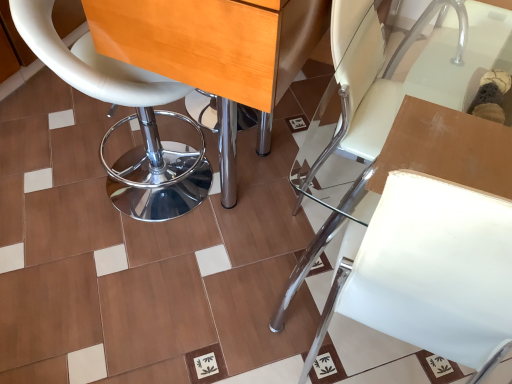
What do you see at coordinates (398, 99) in the screenshot? I see `white leather chair at center, placed as the 2th chair when sorted from left to right` at bounding box center [398, 99].

Where is `white leather chair at center, the first chair in the right-to-left sequence`? white leather chair at center, the first chair in the right-to-left sequence is located at coordinates (398, 99).

Between white leather stool at left, which is the 2th chair from right to left, and wooden table at center, which one has less height?

white leather stool at left, which is the 2th chair from right to left.

Considering the sizes of objects white leather stool at left, which is the 2th chair from right to left, and wooden table at center in the image provided, who is thinner, white leather stool at left, which is the 2th chair from right to left, or wooden table at center?

Thinner between the two is white leather stool at left, which is the 2th chair from right to left.

Can you tell me how much white leather stool at left, placed as the first chair when sorted from left to right, and wooden table at center differ in facing direction?

The facing directions of white leather stool at left, placed as the first chair when sorted from left to right, and wooden table at center are 0.353 degrees apart.

From the image's perspective, which is below, white leather stool at left, which is the 2th chair from right to left, or white leather chair at center, placed as the 2th chair when sorted from left to right?

From the image's view, white leather chair at center, placed as the 2th chair when sorted from left to right, is below.

Which object is thinner, white leather stool at left, placed as the first chair when sorted from left to right, or white leather chair at center, the first chair in the right-to-left sequence?

white leather stool at left, placed as the first chair when sorted from left to right, is thinner.

Which is in front, point (34, 46) or point (308, 172)?

The point (34, 46) is closer.

Between wooden table at center and white leather chair at center, the first chair in the right-to-left sequence, which one has larger width?

Wider between the two is white leather chair at center, the first chair in the right-to-left sequence.

Considering the sizes of objects wooden table at center and white leather chair at center, placed as the 2th chair when sorted from left to right, in the image provided, who is taller, wooden table at center or white leather chair at center, placed as the 2th chair when sorted from left to right,?

wooden table at center.

How different are the orientations of wooden table at center and white leather chair at center, placed as the 2th chair when sorted from left to right, in degrees?

wooden table at center and white leather chair at center, placed as the 2th chair when sorted from left to right, are facing 0.0307 degrees away from each other.

Is wooden table at center aimed at white leather chair at center, the first chair in the right-to-left sequence?

Yes, wooden table at center is aimed at white leather chair at center, the first chair in the right-to-left sequence.

Which object is closer to the camera taking this photo, white leather chair at center, the first chair in the right-to-left sequence, or white leather stool at left, which is the 2th chair from right to left?

white leather chair at center, the first chair in the right-to-left sequence.

Is white leather stool at left, placed as the first chair when sorted from left to right, at the back of white leather chair at center, the first chair in the right-to-left sequence?

That's right, white leather chair at center, the first chair in the right-to-left sequence, is facing away from white leather stool at left, placed as the first chair when sorted from left to right.

From the picture: Between white leather chair at center, the first chair in the right-to-left sequence, and white leather stool at left, placed as the first chair when sorted from left to right, which one appears on the left side from the viewer's perspective?

Positioned to the left is white leather stool at left, placed as the first chair when sorted from left to right.

Is white leather chair at center, placed as the 2th chair when sorted from left to right, positioned with its back to wooden table at center?

Yes, white leather chair at center, placed as the 2th chair when sorted from left to right, is positioned with its back facing wooden table at center.

From the image's perspective, which is above, white leather chair at center, the first chair in the right-to-left sequence, or wooden table at center?

wooden table at center.

Is white leather chair at center, placed as the 2th chair when sorted from left to right, far away from wooden table at center?

No, there isn't a large distance between white leather chair at center, placed as the 2th chair when sorted from left to right, and wooden table at center.

Considering the points (415, 80) and (170, 13), which point is in front, point (415, 80) or point (170, 13)?

Positioned in front is point (170, 13).

Where is `table that is above the white leather stool at left, which is the 2th chair from right to left (from a real-world perspective)`? This screenshot has height=384, width=512. table that is above the white leather stool at left, which is the 2th chair from right to left (from a real-world perspective) is located at coordinates (215, 44).

Is wooden table at center turned away from white leather stool at left, which is the 2th chair from right to left?

Correct, wooden table at center is looking away from white leather stool at left, which is the 2th chair from right to left.

Considering the relative positions of wooden table at center and white leather stool at left, placed as the first chair when sorted from left to right, in the image provided, is wooden table at center to the right of white leather stool at left, placed as the first chair when sorted from left to right, from the viewer's perspective?

Yes, wooden table at center is to the right of white leather stool at left, placed as the first chair when sorted from left to right.

From the image's perspective, which one is positioned higher, wooden table at center or white leather stool at left, placed as the first chair when sorted from left to right?

wooden table at center appears higher in the image.

At what (x,y) coordinates should I click in order to perform the action: click on table in front of the white leather stool at left, placed as the first chair when sorted from left to right. Please return your answer as a coordinate pair (x, y). Looking at the image, I should click on (215, 44).

The height and width of the screenshot is (384, 512). I want to click on chair above the white leather chair at center, the first chair in the right-to-left sequence (from the image's perspective), so pyautogui.click(x=125, y=120).

Estimate the real-world distances between objects in this image. Which object is further from white leather chair at center, the first chair in the right-to-left sequence, wooden table at center or white leather stool at left, placed as the first chair when sorted from left to right?

white leather stool at left, placed as the first chair when sorted from left to right, is positioned further to the anchor white leather chair at center, the first chair in the right-to-left sequence.

Looking at the image, which one is located further to white leather chair at center, placed as the 2th chair when sorted from left to right, white leather stool at left, which is the 2th chair from right to left, or wooden table at center?

Based on the image, white leather stool at left, which is the 2th chair from right to left, appears to be further to white leather chair at center, placed as the 2th chair when sorted from left to right.

Estimate the real-world distances between objects in this image. Which object is closer to wooden table at center, white leather chair at center, placed as the 2th chair when sorted from left to right, or white leather stool at left, placed as the first chair when sorted from left to right?

The object closer to wooden table at center is white leather chair at center, placed as the 2th chair when sorted from left to right.

Looking at the image, which one is located closer to white leather stool at left, placed as the first chair when sorted from left to right, wooden table at center or white leather chair at center, the first chair in the right-to-left sequence?

wooden table at center is positioned closer to the anchor white leather stool at left, placed as the first chair when sorted from left to right.

Which object lies further to the anchor point wooden table at center, white leather stool at left, placed as the first chair when sorted from left to right, or white leather chair at center, the first chair in the right-to-left sequence?

white leather stool at left, placed as the first chair when sorted from left to right, lies further to wooden table at center than the other object.

When comparing their distances from white leather stool at left, which is the 2th chair from right to left, does white leather chair at center, the first chair in the right-to-left sequence, or wooden table at center seem further?

white leather chair at center, the first chair in the right-to-left sequence, is positioned further to the anchor white leather stool at left, which is the 2th chair from right to left.

The width and height of the screenshot is (512, 384). Identify the location of table situated between white leather stool at left, which is the 2th chair from right to left, and white leather chair at center, the first chair in the right-to-left sequence, from left to right. (215, 44).